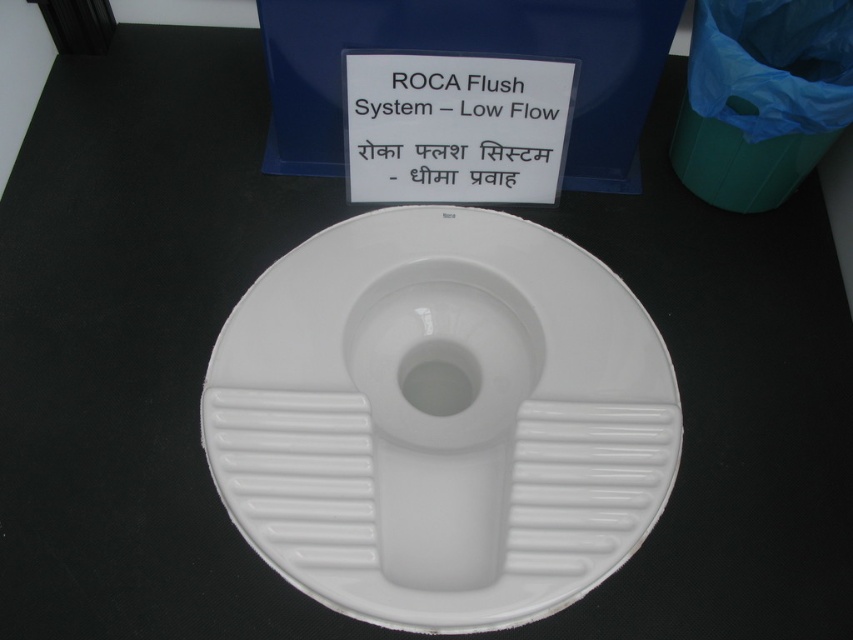
Question: Does white glossy toilet seat at center have a smaller size compared to white glossy toilet bowl at center?

Choices:
 (A) yes
 (B) no

Answer: (B)

Question: Which point is farther from the camera taking this photo?

Choices:
 (A) (514, 394)
 (B) (427, 72)
 (C) (525, 344)

Answer: (B)

Question: Which object appears closest to the camera in this image?

Choices:
 (A) white plastic sign at center
 (B) white glossy toilet seat at center
 (C) white glossy toilet bowl at center

Answer: (B)

Question: Which point is farther to the camera?

Choices:
 (A) (389, 348)
 (B) (520, 124)
 (C) (409, 504)

Answer: (B)

Question: Is white glossy toilet seat at center further to the viewer compared to white glossy toilet bowl at center?

Choices:
 (A) no
 (B) yes

Answer: (A)

Question: Is white glossy toilet seat at center to the left of white glossy toilet bowl at center from the viewer's perspective?

Choices:
 (A) yes
 (B) no

Answer: (B)